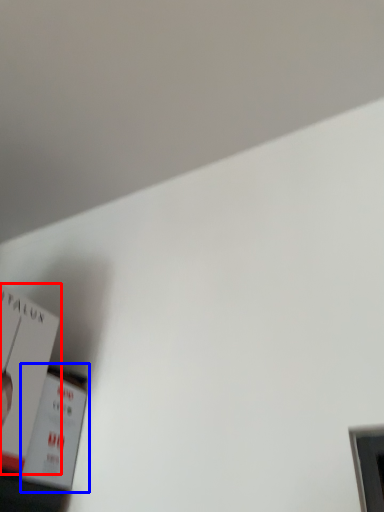
Question: Which object is further to the camera taking this photo, paperback book (highlighted by a red box) or paperback book (highlighted by a blue box)?

Choices:
 (A) paperback book
 (B) paperback book

Answer: (B)